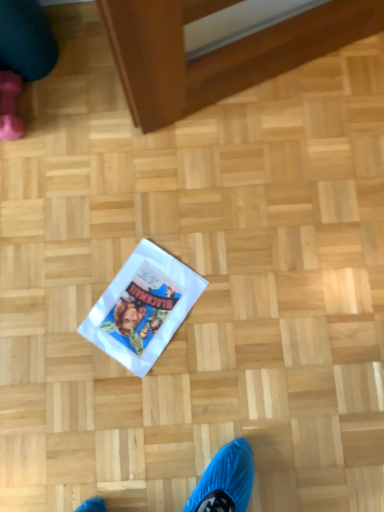
The height and width of the screenshot is (512, 384). Identify the location of free space to the back side of white paper flyer at center. (139, 220).